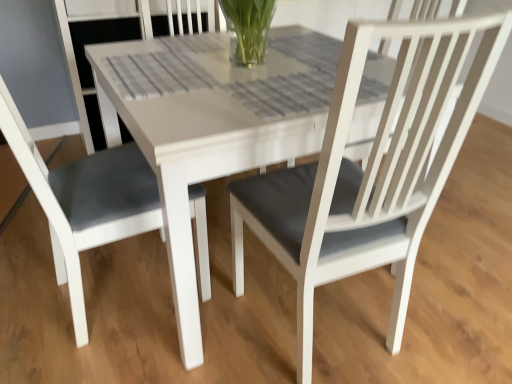
The height and width of the screenshot is (384, 512). I want to click on white matte table at center, so click(x=200, y=144).

What do you see at coordinates (200, 144) in the screenshot?
I see `white matte table at center` at bounding box center [200, 144].

What is the approximate height of white matte table at center?

The height of white matte table at center is 29.30 inches.

What are the coordinates of `matte gray cushion at left` in the screenshot? It's located at (84, 201).

The height and width of the screenshot is (384, 512). What do you see at coordinates (84, 201) in the screenshot?
I see `matte gray cushion at left` at bounding box center [84, 201].

You are a GUI agent. You are given a task and a screenshot of the screen. Output one action in this format:
    pyautogui.click(x=<x>, y=<y>)
    Task: Click on the white matte table at center
    The image size is (512, 384).
    Given the screenshot: What is the action you would take?
    pyautogui.click(x=200, y=144)

Which object is positioned more to the left, white matte table at center or matte gray cushion at left?

matte gray cushion at left.

In the image, is white matte table at center positioned in front of or behind matte gray cushion at left?

In the image, white matte table at center appears behind matte gray cushion at left.

Is point (217, 117) closer to camera compared to point (94, 201)?

Yes, point (217, 117) is in front of point (94, 201).

From the image's perspective, is white matte table at center located above matte gray cushion at left?

Indeed, from the image's perspective, white matte table at center is shown above matte gray cushion at left.

From a real-world perspective, is white matte table at center physically located above or below matte gray cushion at left?

white matte table at center is situated lower than matte gray cushion at left in the real world.

Considering the relative sizes of white matte table at center and matte gray cushion at left in the image provided, is white matte table at center wider than matte gray cushion at left?

Correct, the width of white matte table at center exceeds that of matte gray cushion at left.

From the picture: Considering the sizes of white matte table at center and matte gray cushion at left in the image, is white matte table at center taller or shorter than matte gray cushion at left?

Clearly, white matte table at center is shorter compared to matte gray cushion at left.

Is white matte table at center bigger than matte gray cushion at left?

Correct, white matte table at center is larger in size than matte gray cushion at left.

Can matte gray cushion at left be found inside white matte table at center?

No, matte gray cushion at left is not a part of white matte table at center.

Would you consider white matte table at center to be distant from matte gray cushion at left?

No, white matte table at center is in close proximity to matte gray cushion at left.

Looking at this image, is white matte table at center oriented away from matte gray cushion at left?

white matte table at center is not turned away from matte gray cushion at left.

How different are the orientations of white matte table at center and matte gray cushion at left in degrees?

The angle between the facing direction of white matte table at center and the facing direction of matte gray cushion at left is 93.8 degrees.

Consider the image. How much distance is there between white matte table at center and matte gray cushion at left?

12.21 inches.

In the image, there is a matte gray cushion at left. Where is `round table below it (from a real-world perspective)`? round table below it (from a real-world perspective) is located at coordinates (200, 144).

Is matte gray cushion at left to the left or to the right of white matte table at center in the image?

Based on their positions, matte gray cushion at left is located to the left of white matte table at center.

Is matte gray cushion at left in front of white matte table at center?

That is True.

Considering the points (98, 224) and (99, 68), which point is in front, point (98, 224) or point (99, 68)?

Positioned in front is point (98, 224).

From the image's perspective, does matte gray cushion at left appear lower than white matte table at center?

Indeed, from the image's perspective, matte gray cushion at left is shown beneath white matte table at center.

From a real-world perspective, who is located higher, matte gray cushion at left or white matte table at center?

matte gray cushion at left.

Looking at their sizes, would you say matte gray cushion at left is wider or thinner than white matte table at center?

Clearly, matte gray cushion at left has less width compared to white matte table at center.

Considering the sizes of objects matte gray cushion at left and white matte table at center in the image provided, who is shorter, matte gray cushion at left or white matte table at center?

white matte table at center is shorter.

Considering the sizes of matte gray cushion at left and white matte table at center in the image, is matte gray cushion at left bigger or smaller than white matte table at center?

Considering their sizes, matte gray cushion at left takes up less space than white matte table at center.

Is matte gray cushion at left not within white matte table at center?

Yes.

Can you see matte gray cushion at left touching white matte table at center?

No, matte gray cushion at left is not beside white matte table at center.

Is matte gray cushion at left aimed at white matte table at center?

Yes, matte gray cushion at left is turned towards white matte table at center.

Identify the location of chair in front of the white matte table at center. (84, 201).

The height and width of the screenshot is (384, 512). I want to click on chair on the left of white matte table at center, so click(84, 201).

Where is `round table on the right of matte gray cushion at left`? round table on the right of matte gray cushion at left is located at coordinates (200, 144).